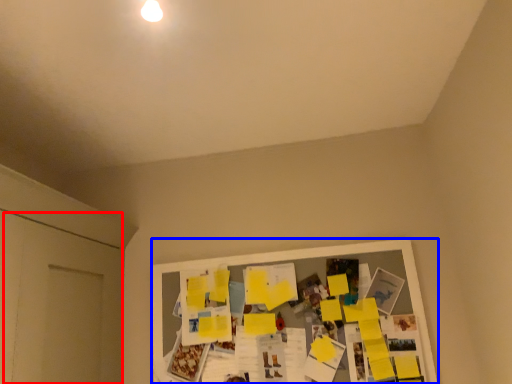
Question: Which object is closer to the camera taking this photo, door (highlighted by a red box) or bulletin board (highlighted by a blue box)?

Choices:
 (A) door
 (B) bulletin board

Answer: (A)